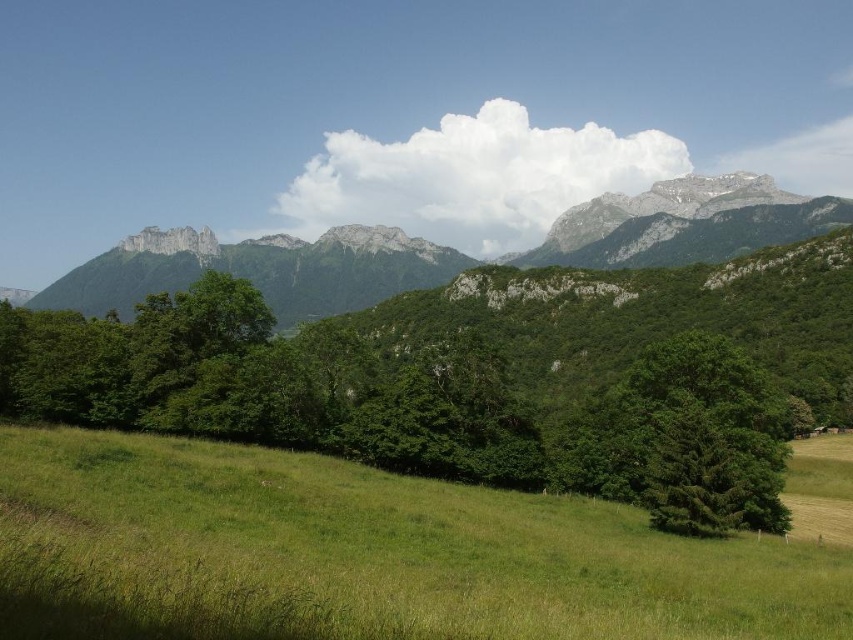
Question: Does green grassy field at lower center have a smaller size compared to rugged stone mountain range at center?

Choices:
 (A) yes
 (B) no

Answer: (A)

Question: Does rugged stone mountain range at center have a greater width compared to green leafy tree at center-right?

Choices:
 (A) no
 (B) yes

Answer: (B)

Question: Which point is farther to the camera?

Choices:
 (A) rugged stone mountain range at center
 (B) green grassy field at lower center

Answer: (A)

Question: Among these points, which one is nearest to the camera?

Choices:
 (A) (759, 376)
 (B) (625, 260)
 (C) (476, 525)

Answer: (C)

Question: Is rugged stone mountain range at center smaller than green leafy tree at center-right?

Choices:
 (A) no
 (B) yes

Answer: (A)

Question: Which point is farther to the camera?

Choices:
 (A) green grassy field at lower center
 (B) green leafy tree at center-right

Answer: (B)